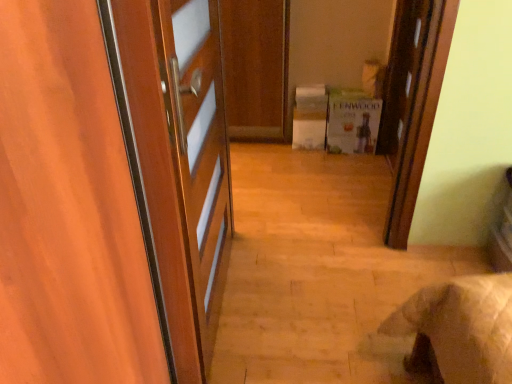
Question: From the image's perspective, does green cardboard box at center appear lower than wooden door at upper right, which is the first door from right to left?

Choices:
 (A) no
 (B) yes

Answer: (B)

Question: Is green cardboard box at center at the right side of wooden door at upper right, marked as the first door in a back-to-front arrangement?

Choices:
 (A) yes
 (B) no

Answer: (B)

Question: Does green cardboard box at center have a smaller size compared to wooden door at upper right, acting as the first door starting from the top?

Choices:
 (A) yes
 (B) no

Answer: (A)

Question: Is green cardboard box at center bigger than wooden door at upper right, acting as the first door starting from the top?

Choices:
 (A) no
 (B) yes

Answer: (A)

Question: Is green cardboard box at center positioned behind wooden door at upper right, marked as the 2th door in a front-to-back arrangement?

Choices:
 (A) yes
 (B) no

Answer: (A)

Question: Is green cardboard box at center taller or shorter than wooden door at upper right, acting as the first door starting from the top?

Choices:
 (A) tall
 (B) short

Answer: (B)

Question: Considering the positions of green cardboard box at center and wooden door at upper right, which appears as the second door when ordered from the bottom, in the image, is green cardboard box at center wider or thinner than wooden door at upper right, which appears as the second door when ordered from the bottom,?

Choices:
 (A) thin
 (B) wide

Answer: (B)

Question: In the image, is green cardboard box at center on the left side or the right side of wooden door at upper right, which appears as the second door when ordered from the bottom?

Choices:
 (A) left
 (B) right

Answer: (A)

Question: In the image, is green cardboard box at center positioned in front of or behind wooden door at upper right, which ranks as the 2th door in left-to-right order?

Choices:
 (A) front
 (B) behind

Answer: (B)

Question: From the image's perspective, is wooden door at left, which is counted as the first door, starting from the bottom, above or below green cardboard box at center?

Choices:
 (A) above
 (B) below

Answer: (B)

Question: Choose the correct answer: Is wooden door at left, the second door viewed from the back, inside green cardboard box at center or outside it?

Choices:
 (A) inside
 (B) outside

Answer: (B)

Question: Considering the positions of wooden door at left, positioned as the 1th door in front-to-back order, and green cardboard box at center in the image, is wooden door at left, positioned as the 1th door in front-to-back order, wider or thinner than green cardboard box at center?

Choices:
 (A) wide
 (B) thin

Answer: (B)

Question: From a real-world perspective, relative to green cardboard box at center, is wooden door at left, the second door viewed from the back, vertically above or below?

Choices:
 (A) below
 (B) above

Answer: (B)

Question: Considering the positions of point (120, 144) and point (433, 119), is point (120, 144) closer or farther from the camera than point (433, 119)?

Choices:
 (A) farther
 (B) closer

Answer: (B)

Question: Visually, is wooden door at left, the second door viewed from the back, positioned to the left or to the right of wooden door at upper right, which appears as the second door when ordered from the bottom?

Choices:
 (A) right
 (B) left

Answer: (B)